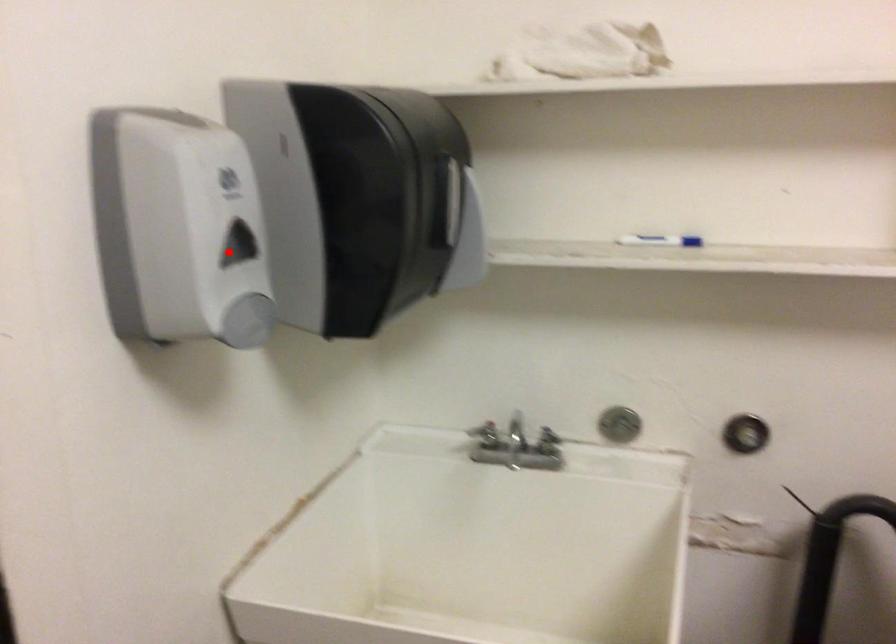
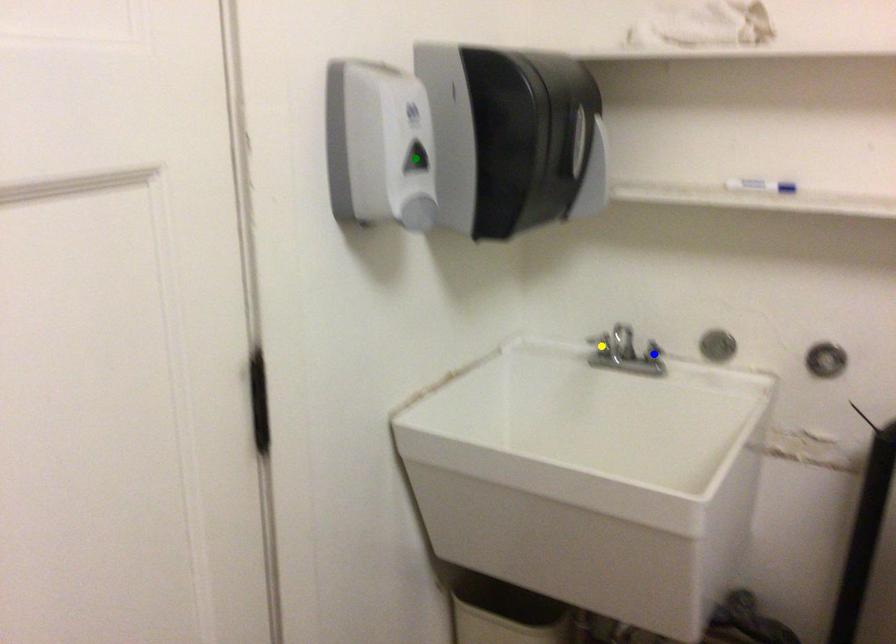
Question: I am providing you with two images of the same scene from different viewpoints. A red point is marked on the first image. You are given multiple points on the second image. Which spot in image 2 lines up with the point in image 1?

Choices:
 (A) green point
 (B) yellow point
 (C) blue point

Answer: (A)